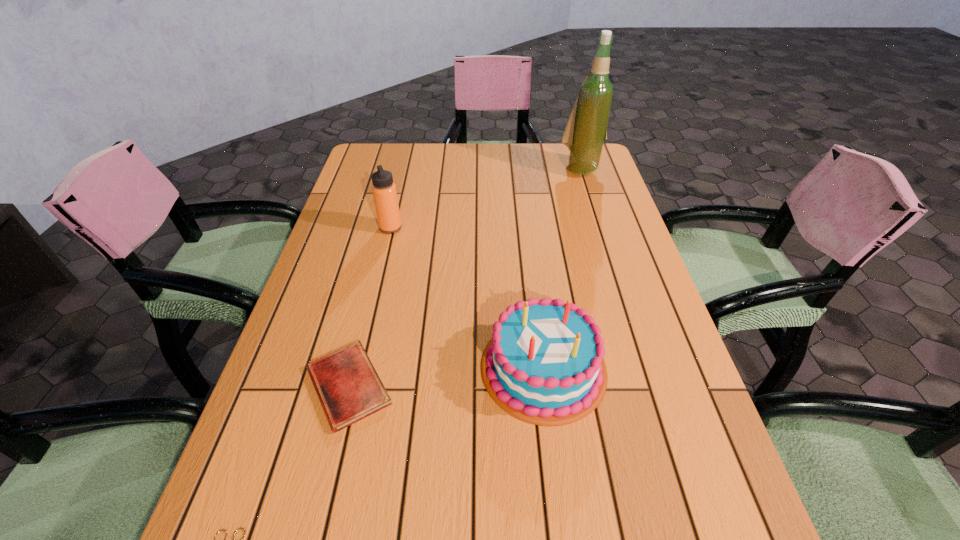
The height and width of the screenshot is (540, 960). In order to click on free space at the far left corner of the desktop in this screenshot , I will do `click(360, 160)`.

The height and width of the screenshot is (540, 960). Find the location of `vacant space at the far right corner`. vacant space at the far right corner is located at coordinates (573, 172).

This screenshot has height=540, width=960. In order to click on vacant point located between the birthday cake and the thermos bottle in this screenshot , I will do `click(467, 298)`.

The image size is (960, 540). What are the coordinates of `vacant space in between the fourth object from left to right and the rightmost object` in the screenshot? It's located at (562, 268).

You are a GUI agent. You are given a task and a screenshot of the screen. Output one action in this format:
    pyautogui.click(x=<x>, y=<y>)
    Task: Click on the free space between the wine bottle and the third shortest object
    The image size is (960, 540).
    Given the screenshot: What is the action you would take?
    pyautogui.click(x=562, y=268)

I want to click on free space between the second object from right to left and the fourth nearest object, so click(467, 298).

Find the location of a particular element. Image resolution: width=960 pixels, height=540 pixels. vacant area between the wine bottle and the second farthest object is located at coordinates (486, 199).

At what (x,y) coordinates should I click in order to perform the action: click on vacant space in between the farthest object and the third shortest object. Please return your answer as a coordinate pair (x, y). Looking at the image, I should click on (562, 268).

The height and width of the screenshot is (540, 960). What are the coordinates of `empty location between the thermos bottle and the diary` in the screenshot? It's located at (370, 307).

The height and width of the screenshot is (540, 960). In order to click on vacant space in between the tallest object and the diary in this screenshot , I will do `click(465, 278)`.